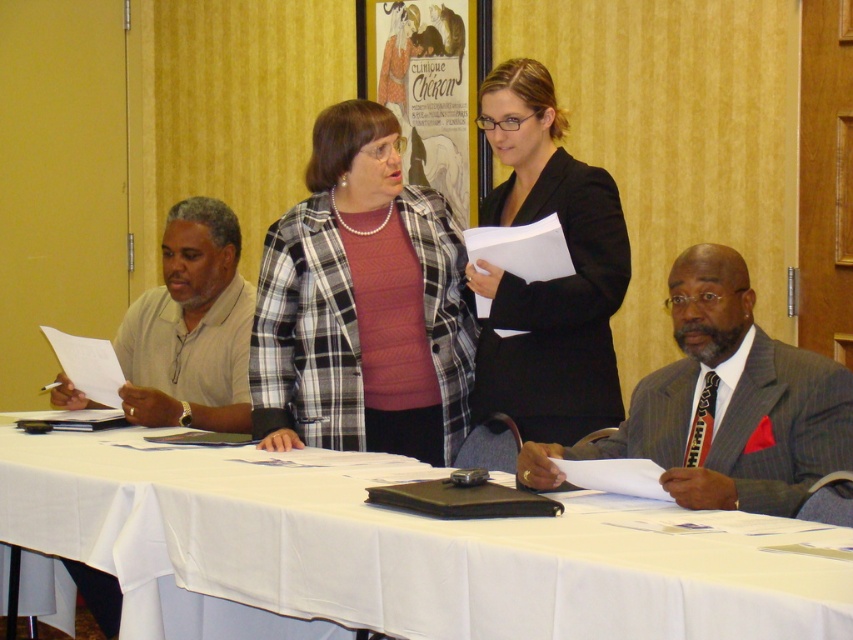
You are a guest at this meeting. You need to place a name tag on the table. Which object is closer to you, the white cloth at center or the plaid fabric shirt at center?

The white cloth at center is closer to you because it is located below the plaid fabric shirt at center, meaning it is positioned lower and nearer to the table surface.

You are a photographer positioned at the back of the room. You need to capture a photo where both the gray pinstripe suit at lower right and the light beige shirt at left are visible. Which participant should you position closer to the camera to ensure both are fully visible in the frame?

Since the gray pinstripe suit at lower right is shorter than the light beige shirt at left, you should position the gray pinstripe suit at lower right closer to the camera to ensure both are fully visible in the frame.

You are a guest entering the room and want to sit at the table. There is a white cloth at center and a plaid fabric shirt at center. Which object is located to the left of the other?

The white cloth at center is positioned on the left side of plaid fabric shirt at center.